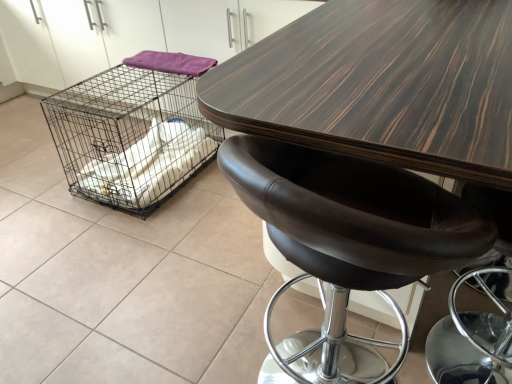
Question: Would you say purple fabric at upper left is a long distance from brown leather stool at center?

Choices:
 (A) no
 (B) yes

Answer: (B)

Question: Is purple fabric at upper left positioned behind brown leather stool at center?

Choices:
 (A) no
 (B) yes

Answer: (B)

Question: Does purple fabric at upper left appear on the right side of brown leather stool at center?

Choices:
 (A) no
 (B) yes

Answer: (A)

Question: From a real-world perspective, is purple fabric at upper left on top of brown leather stool at center?

Choices:
 (A) yes
 (B) no

Answer: (A)

Question: Can you confirm if purple fabric at upper left is thinner than brown leather stool at center?

Choices:
 (A) no
 (B) yes

Answer: (B)

Question: Considering the relative sizes of purple fabric at upper left and brown leather stool at center in the image provided, is purple fabric at upper left smaller than brown leather stool at center?

Choices:
 (A) no
 (B) yes

Answer: (B)

Question: From a real-world perspective, is purple fabric at upper left on top of dark wood table at center?

Choices:
 (A) no
 (B) yes

Answer: (B)

Question: Is purple fabric at upper left far from dark wood table at center?

Choices:
 (A) yes
 (B) no

Answer: (A)

Question: Is purple fabric at upper left oriented towards dark wood table at center?

Choices:
 (A) no
 (B) yes

Answer: (A)

Question: Can you confirm if purple fabric at upper left is shorter than dark wood table at center?

Choices:
 (A) yes
 (B) no

Answer: (A)

Question: Is purple fabric at upper left outside of dark wood table at center?

Choices:
 (A) yes
 (B) no

Answer: (A)

Question: Is purple fabric at upper left next to dark wood table at center and touching it?

Choices:
 (A) no
 (B) yes

Answer: (A)

Question: From a real-world perspective, is black wire mesh cage at left positioned over purple fabric at upper left based on gravity?

Choices:
 (A) no
 (B) yes

Answer: (A)